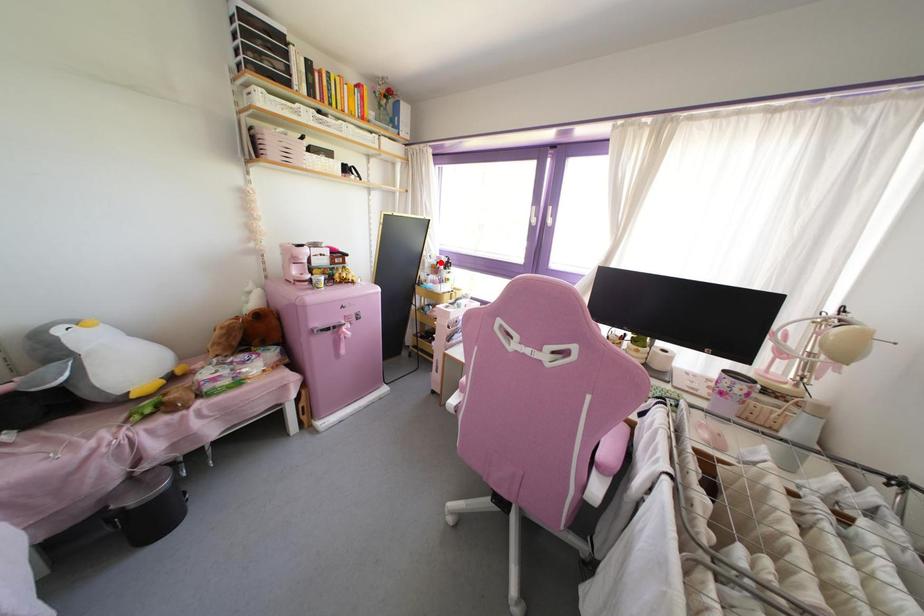
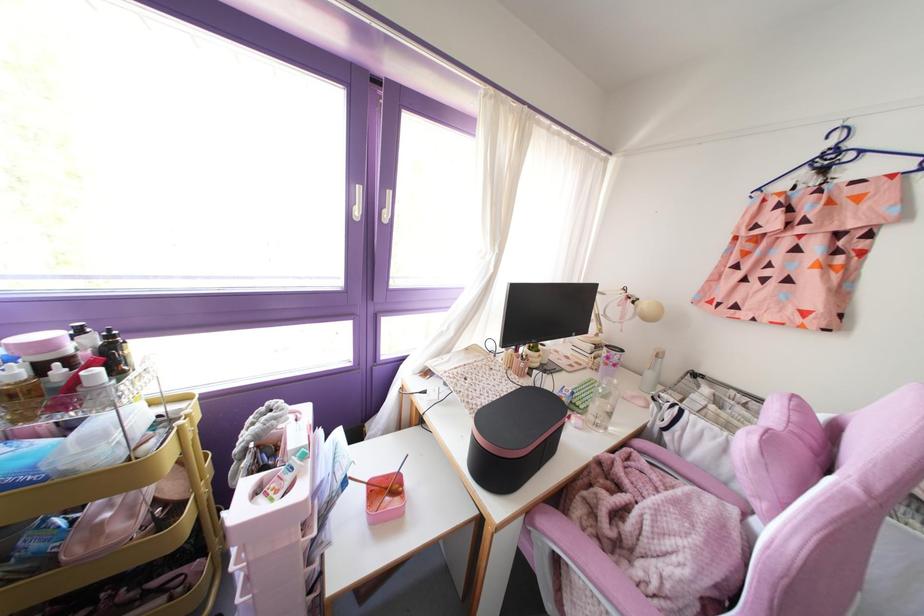
In the second image, find the point that corresponds to the highlighted location in the first image.

(67, 360)